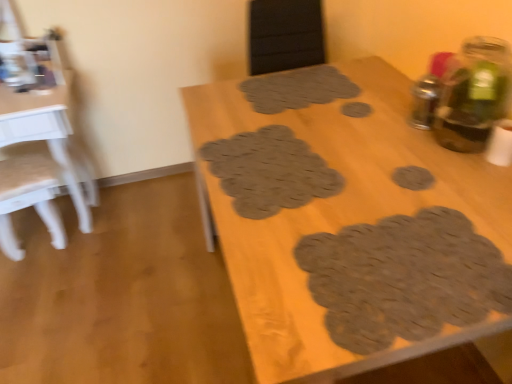
Where is `free space between brown textured mat at bottom right, marked as the fifth footprint in a top-to-bottom arrangement, and brown textured mat at center, arranged as the second footprint when viewed from the front`? The image size is (512, 384). free space between brown textured mat at bottom right, marked as the fifth footprint in a top-to-bottom arrangement, and brown textured mat at center, arranged as the second footprint when viewed from the front is located at coordinates (344, 210).